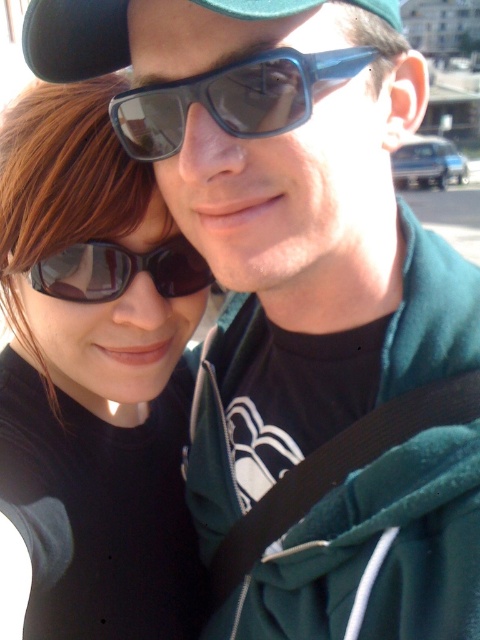
Which is more to the right, matte dark blue sunglasses at center or matte black sunglasses at center?

matte dark blue sunglasses at center

Does matte dark blue sunglasses at center appear on the right side of matte black sunglasses at center?

Correct, you'll find matte dark blue sunglasses at center to the right of matte black sunglasses at center.

This screenshot has height=640, width=480. In order to click on matte dark blue sunglasses at center in this screenshot , I will do `click(233, 99)`.

Between point (62, 435) and point (266, 125), which one is positioned behind?

The point (62, 435) is behind.

Is matte black sunglasses at left below matte dark blue sunglasses at center?

Correct, matte black sunglasses at left is located below matte dark blue sunglasses at center.

Measure the distance between point (156, 268) and camera.

3.08 meters

Locate an element on the screen. matte black sunglasses at left is located at coordinates (96, 372).

The width and height of the screenshot is (480, 640). What are the coordinates of `green fabric baseball cap at upper center` in the screenshot? It's located at (75, 38).

Can you confirm if green fabric baseball cap at upper center is wider than matte black sunglasses at center?

Incorrect, green fabric baseball cap at upper center's width does not surpass matte black sunglasses at center's.

Is point (115, 17) in front of point (181, 272)?

Yes.

Where is `green fabric baseball cap at upper center`? green fabric baseball cap at upper center is located at coordinates (75, 38).